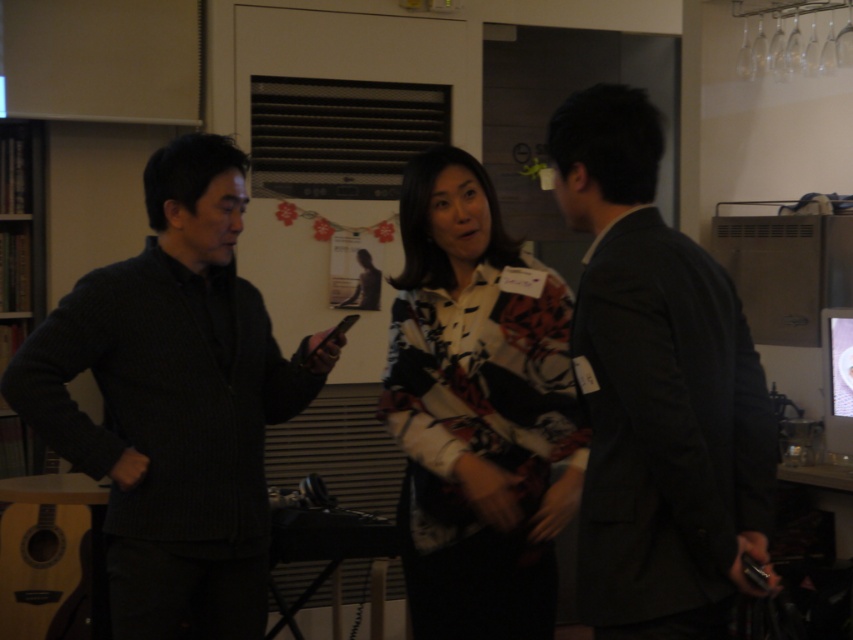
You are standing in the room and want to move from the point at coordinates (80, 412) to the point at (584, 531). Which direction should you move in to get closer to your destination?

You should move forward because the point at (584, 531) is further away from you than the point at (80, 412).